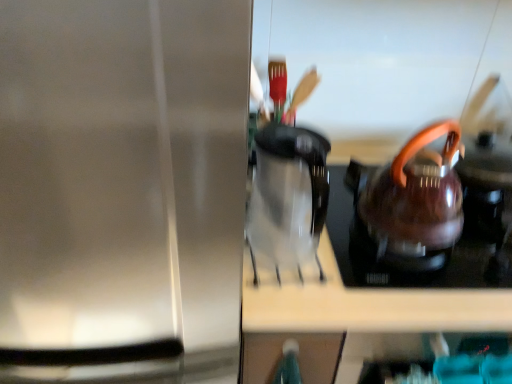
Question: Considering the relative sizes of stainless steel kettle at right and shiny metallic kettle at right in the image provided, is stainless steel kettle at right smaller than shiny metallic kettle at right?

Choices:
 (A) yes
 (B) no

Answer: (B)

Question: Is stainless steel kettle at right bigger than shiny metallic kettle at right?

Choices:
 (A) yes
 (B) no

Answer: (A)

Question: Can you confirm if stainless steel kettle at right is positioned to the left of shiny metallic kettle at right?

Choices:
 (A) yes
 (B) no

Answer: (A)

Question: Can you confirm if stainless steel kettle at right is wider than shiny metallic kettle at right?

Choices:
 (A) no
 (B) yes

Answer: (B)

Question: Is stainless steel kettle at right outside of shiny metallic kettle at right?

Choices:
 (A) no
 (B) yes

Answer: (B)

Question: From the image's perspective, does stainless steel kettle at right appear lower than shiny metallic kettle at right?

Choices:
 (A) yes
 (B) no

Answer: (A)

Question: From the image's perspective, would you say shiny metallic kettle at right is positioned over transparent glass coffee pot at center?

Choices:
 (A) no
 (B) yes

Answer: (B)

Question: Does shiny metallic kettle at right turn towards transparent glass coffee pot at center?

Choices:
 (A) no
 (B) yes

Answer: (A)

Question: Does shiny metallic kettle at right have a lesser height compared to transparent glass coffee pot at center?

Choices:
 (A) yes
 (B) no

Answer: (A)

Question: Is transparent glass coffee pot at center completely or partially inside shiny metallic kettle at right?

Choices:
 (A) no
 (B) yes

Answer: (A)

Question: Is shiny metallic kettle at right to the right of transparent glass coffee pot at center from the viewer's perspective?

Choices:
 (A) no
 (B) yes

Answer: (B)

Question: Does shiny metallic kettle at right appear on the left side of transparent glass coffee pot at center?

Choices:
 (A) yes
 (B) no

Answer: (B)

Question: From the image's perspective, is transparent glass coffee pot at center below stainless steel kettle at right?

Choices:
 (A) no
 (B) yes

Answer: (A)